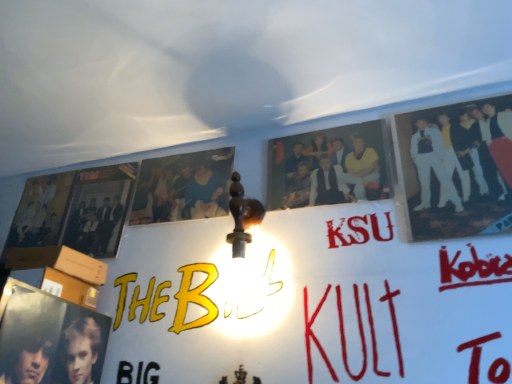
Question: Can you confirm if matte black poster at left is wider than white glossy suit at upper right, the 3th person when ordered from left to right?

Choices:
 (A) no
 (B) yes

Answer: (B)

Question: Considering the relative sizes of matte black poster at left and white glossy suit at upper right, acting as the 1th person starting from the right, in the image provided, is matte black poster at left bigger than white glossy suit at upper right, acting as the 1th person starting from the right,?

Choices:
 (A) yes
 (B) no

Answer: (A)

Question: Is matte black poster at left taller than white glossy suit at upper right, acting as the 1th person starting from the right?

Choices:
 (A) no
 (B) yes

Answer: (A)

Question: Can you confirm if matte black poster at left is thinner than white glossy suit at upper right, acting as the 1th person starting from the right?

Choices:
 (A) no
 (B) yes

Answer: (A)

Question: Is matte black poster at left outside of white glossy suit at upper right, acting as the 1th person starting from the right?

Choices:
 (A) yes
 (B) no

Answer: (A)

Question: Does point (105, 201) appear closer or farther from the camera than point (303, 175)?

Choices:
 (A) farther
 (B) closer

Answer: (A)

Question: From the image's perspective, is matte black poster at left located above or below matte black photo at center, marked as the second person in a right-to-left arrangement?

Choices:
 (A) above
 (B) below

Answer: (B)

Question: Considering their positions, is matte black poster at left located in front of or behind matte black photo at center, marked as the second person in a right-to-left arrangement?

Choices:
 (A) front
 (B) behind

Answer: (B)

Question: In the image, is matte black poster at left on the left side or the right side of matte black photo at center, which is the 2th person in left-to-right order?

Choices:
 (A) right
 (B) left

Answer: (B)

Question: From their relative heights in the image, would you say white glossy suit at upper right, the 3th person when ordered from left to right, is taller or shorter than matte black photo at center, which is the 2th person in left-to-right order?

Choices:
 (A) tall
 (B) short

Answer: (A)

Question: Is point (439, 157) closer or farther from the camera than point (283, 150)?

Choices:
 (A) farther
 (B) closer

Answer: (B)

Question: In terms of width, does white glossy suit at upper right, acting as the 1th person starting from the right, look wider or thinner when compared to matte black photo at center, which is the 2th person in left-to-right order?

Choices:
 (A) thin
 (B) wide

Answer: (B)

Question: From a real-world perspective, relative to matte black photo at center, which is the 2th person in left-to-right order, is white glossy suit at upper right, the 3th person when ordered from left to right, vertically above or below?

Choices:
 (A) below
 (B) above

Answer: (A)

Question: From a real-world perspective, relative to white glossy suit at upper right, the 3th person when ordered from left to right, is blue cotton shirt at upper center, arranged as the 1th person when viewed from the left, vertically above or below?

Choices:
 (A) above
 (B) below

Answer: (A)

Question: Considering the positions of blue cotton shirt at upper center, which is the 3th person from right to left, and white glossy suit at upper right, acting as the 1th person starting from the right, in the image, is blue cotton shirt at upper center, which is the 3th person from right to left, bigger or smaller than white glossy suit at upper right, acting as the 1th person starting from the right,?

Choices:
 (A) small
 (B) big

Answer: (A)